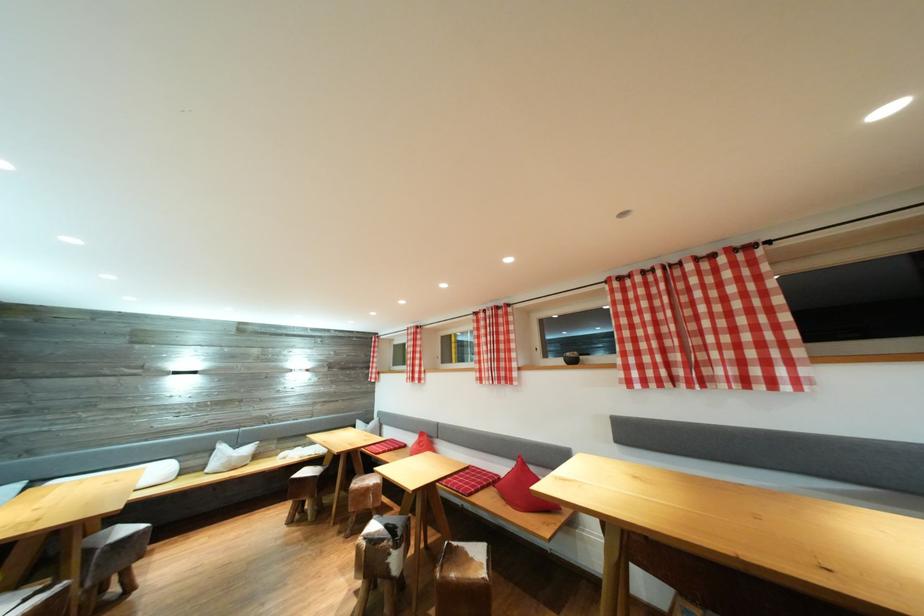
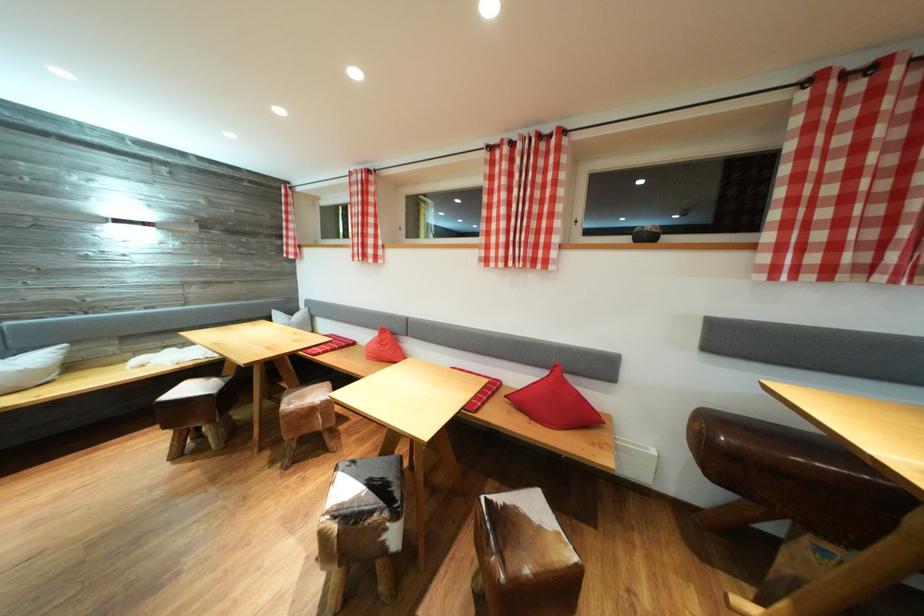
The point at (627, 284) is marked in the first image. Where is the corresponding point in the second image?

(852, 81)